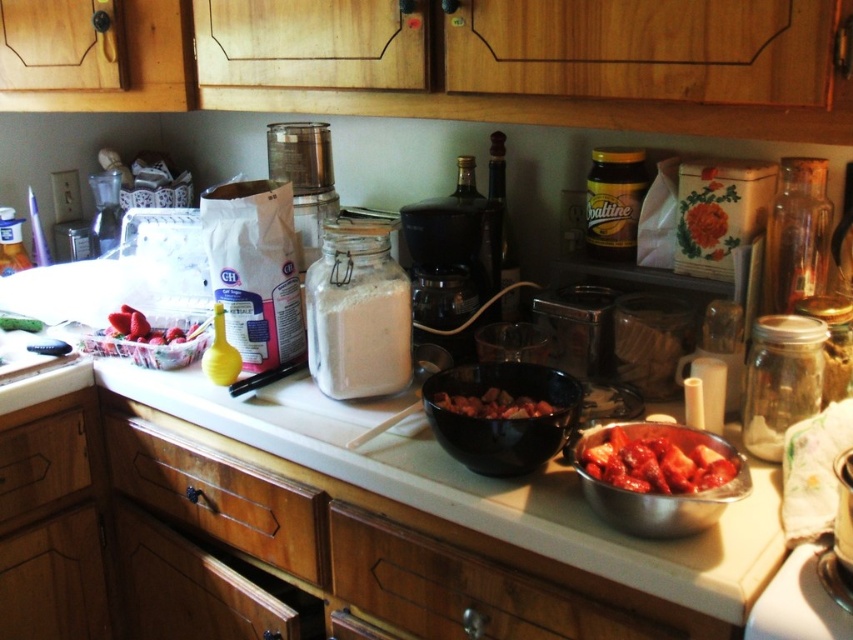
Question: Can you confirm if bright red tomato at right is positioned to the right of brown matte meat at center?

Choices:
 (A) no
 (B) yes

Answer: (B)

Question: Which object is the farthest from the bright red tomato at right?

Choices:
 (A) clear glass jar at center
 (B) wooden drawer at lower left
 (C) wooden drawer at center

Answer: (B)

Question: Which point is closer to the camera?

Choices:
 (A) (524, 461)
 (B) (289, 532)
 (C) (474, 413)

Answer: (A)

Question: Does wooden drawer at center appear over bright red tomato at right?

Choices:
 (A) yes
 (B) no

Answer: (B)

Question: Which object appears closest to the camera in this image?

Choices:
 (A) wooden drawer at lower left
 (B) clear glass jar at center
 (C) bright red tomato at right
 (D) brown matte meat at center

Answer: (C)

Question: Does wooden drawer at lower left appear over brown matte meat at center?

Choices:
 (A) no
 (B) yes

Answer: (A)